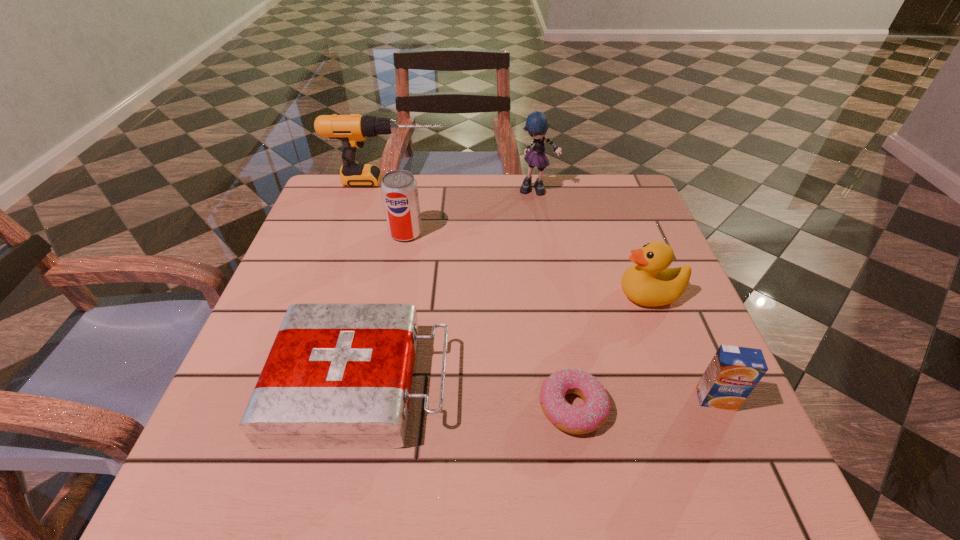
At what (x,y) coordinates should I click in order to perform the action: click on vacant space located 0.170m at the beak of the duck. Please return your answer as a coordinate pair (x, y). The width and height of the screenshot is (960, 540). Looking at the image, I should click on (537, 294).

Find the location of a particular element. free location located at the beak of the duck is located at coordinates (469, 294).

The width and height of the screenshot is (960, 540). Find the location of `vacant space positioned 0.340m at the beak of the duck`. vacant space positioned 0.340m at the beak of the duck is located at coordinates (456, 294).

Locate an element on the screen. vacant space located on the back of the orange_juice is located at coordinates (671, 295).

Find the location of a particular element. The width and height of the screenshot is (960, 540). free space located on the front side of the first-aid kit is located at coordinates (580, 384).

The width and height of the screenshot is (960, 540). I want to click on vacant position located 0.270m on the left of the shortest object, so click(x=375, y=408).

You are a GUI agent. You are given a task and a screenshot of the screen. Output one action in this format:
    pyautogui.click(x=<x>, y=<y>)
    Task: Click on the rag doll located in the far edge section of the desktop
    This screenshot has height=540, width=960.
    Given the screenshot: What is the action you would take?
    pyautogui.click(x=537, y=125)

You are a GUI agent. You are given a task and a screenshot of the screen. Output one action in this format:
    pyautogui.click(x=<x>, y=<y>)
    Task: Click on the drill that is at the far edge
    
    Given the screenshot: What is the action you would take?
    pyautogui.click(x=352, y=130)

You are a GUI agent. You are given a task and a screenshot of the screen. Output one action in this format:
    pyautogui.click(x=<x>, y=<y>)
    Task: Click on the soda that is at the far edge
    
    Given the screenshot: What is the action you would take?
    pyautogui.click(x=399, y=189)

What are the coordinates of `the first-aid kit at the near edge` in the screenshot? It's located at tap(338, 376).